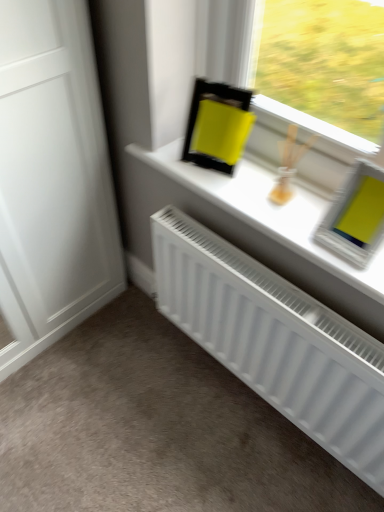
This screenshot has width=384, height=512. I want to click on free space above white matte radiator at lower center (from a real-world perspective), so click(x=155, y=417).